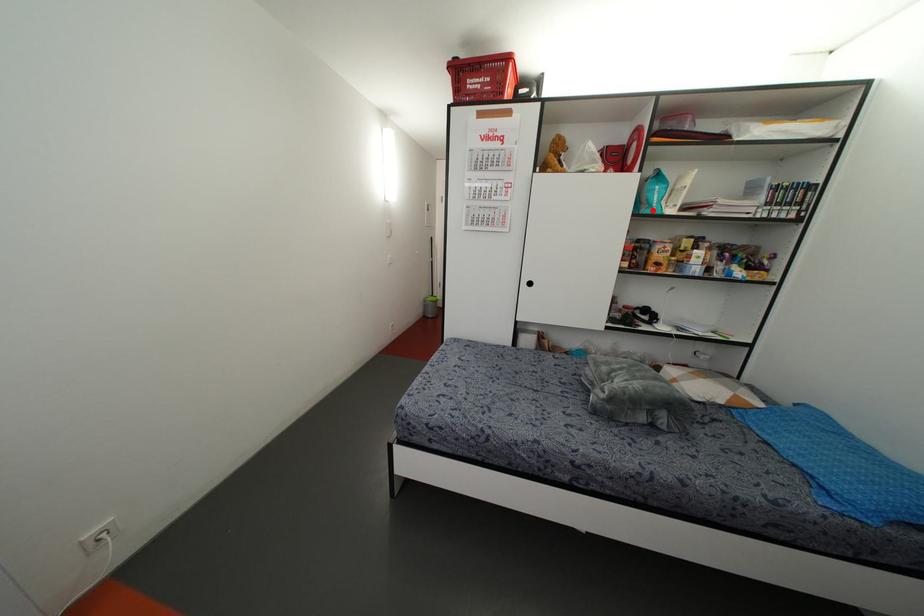
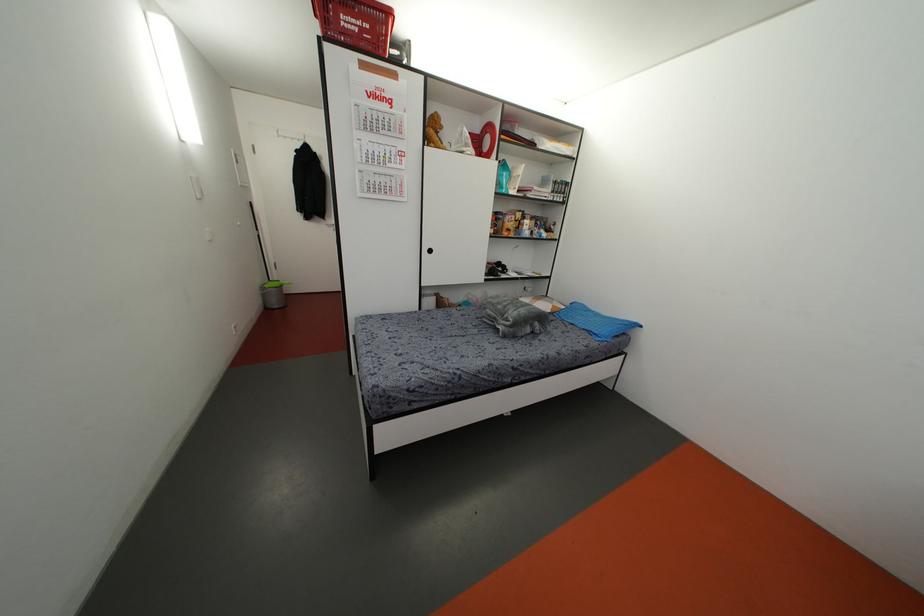
Question: A red point is marked in image1. In image2, is the corresponding 3D point closer to the camera or farther? Reply with the corresponding letter.

Choices:
 (A) The corresponding 3D point is closer.
 (B) The corresponding 3D point is farther.

Answer: (A)